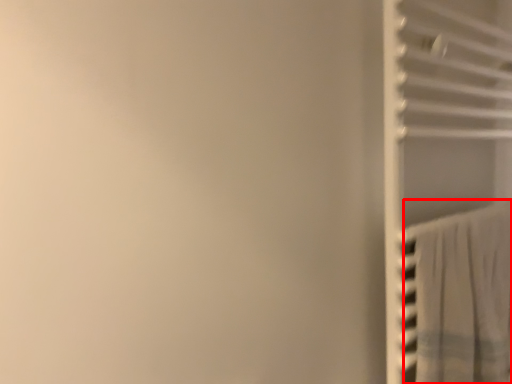
Question: In this image, where is curtain (annotated by the red box) located relative to closet?

Choices:
 (A) right
 (B) left

Answer: (B)